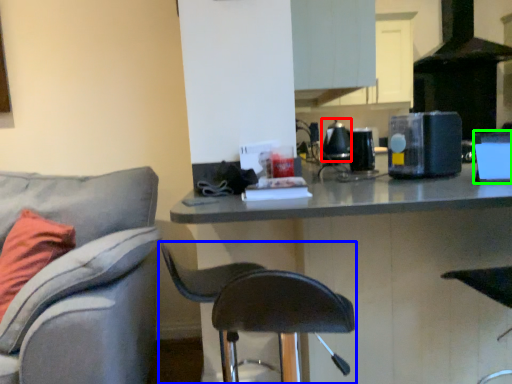
Question: Based on their relative distances, which object is farther from appliance (highlighted by a red box)? Choose from chair (highlighted by a blue box) and appliance (highlighted by a green box).

Choices:
 (A) chair
 (B) appliance

Answer: (A)